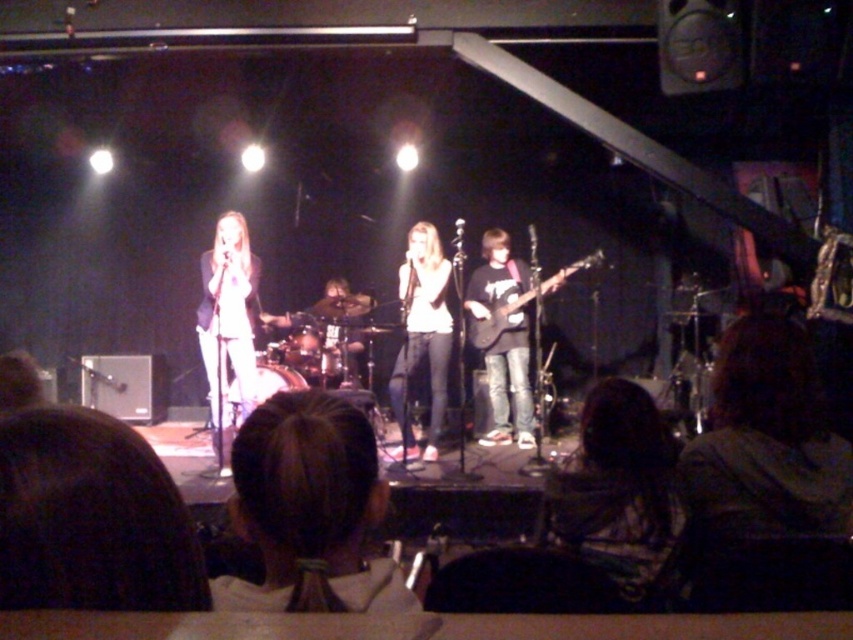
Who is positioned more to the right, brown hair at center or matte black electric guitar at center?

matte black electric guitar at center

Which of these two, brown hair at center or matte black electric guitar at center, stands shorter?

brown hair at center

Identify the location of brown hair at center. coord(309,509).

Identify the location of brown hair at center. (309, 509).

Who is lower down, brown hair at center or shiny silver drum set at center?

brown hair at center is lower down.

Does brown hair at center have a lesser width compared to shiny silver drum set at center?

Correct, brown hair at center's width is less than shiny silver drum set at center's.

Between point (299, 589) and point (325, 344), which one is positioned in front?

Point (299, 589) is more forward.

Where is `brown hair at center`? brown hair at center is located at coordinates (309, 509).

Who is more forward, (x=514, y=406) or (x=433, y=308)?

Positioned in front is point (x=433, y=308).

Does black matte guitar at center have a smaller size compared to white matte shirt at center?

Actually, black matte guitar at center might be larger than white matte shirt at center.

Locate an element on the screen. This screenshot has width=853, height=640. black matte guitar at center is located at coordinates (509, 385).

Locate an element on the screen. black matte guitar at center is located at coordinates (509, 385).